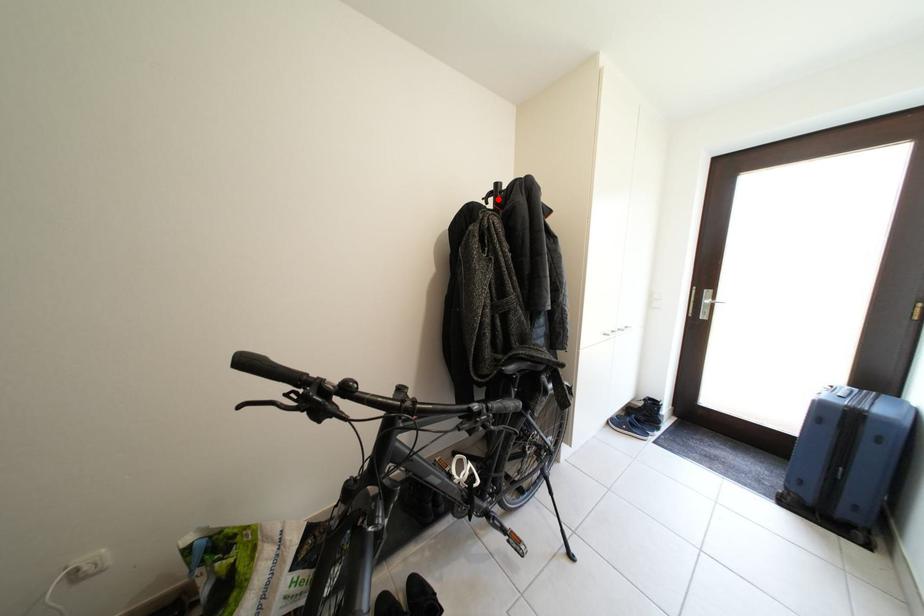
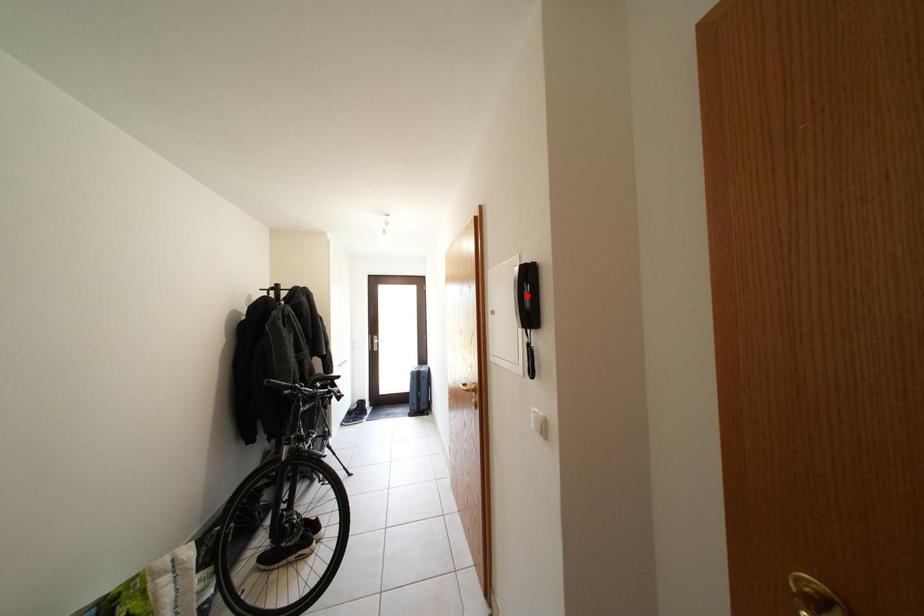
I am providing you with two images of the same scene from different viewpoints. A red point is marked on the first image and another point is marked on the second image. Do the highlighted points in image1 and image2 indicate the same real-world spot?

No